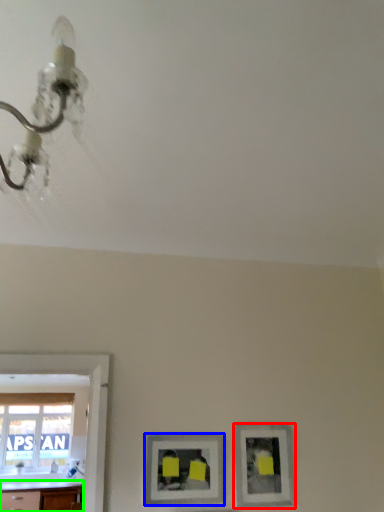
Question: Based on their relative distances, which object is nearer to picture frame (highlighted by a red box)? Choose from picture frame (highlighted by a blue box) and counter top (highlighted by a green box).

Choices:
 (A) picture frame
 (B) counter top

Answer: (A)